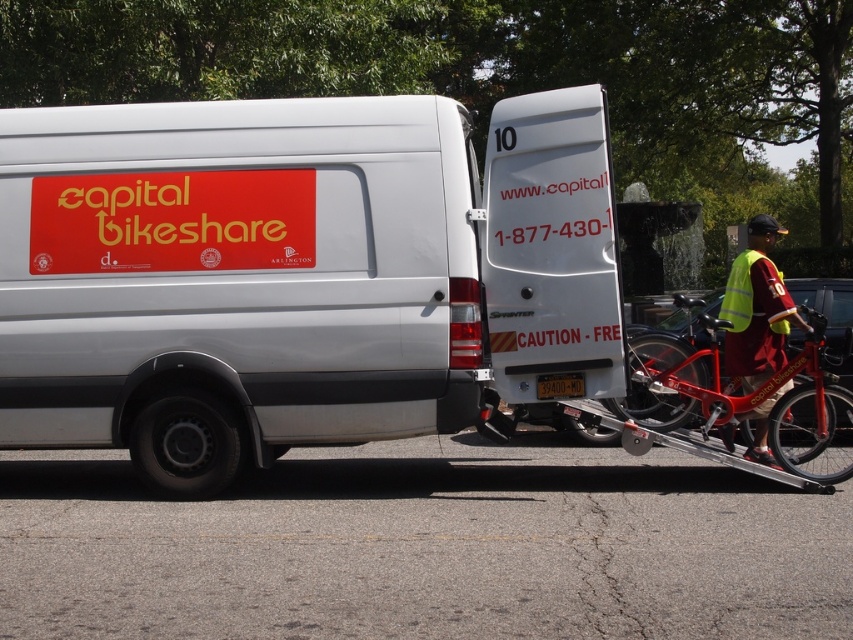
Does white matte van at center appear on the right side of reflective yellow vest at right?

No, white matte van at center is not to the right of reflective yellow vest at right.

Can you confirm if white matte van at center is thinner than reflective yellow vest at right?

Yes.

Which is in front, point (376, 250) or point (756, 314)?

Positioned in front is point (376, 250).

Find the location of a particular element. Image resolution: width=853 pixels, height=640 pixels. white matte van at center is located at coordinates coord(299,275).

Who is positioned more to the left, metallic red bicycle at right or reflective yellow vest at right?

metallic red bicycle at right

Which is behind, point (846, 458) or point (741, 269)?

The point (846, 458) is more distant.

This screenshot has width=853, height=640. In order to click on metallic red bicycle at right in this screenshot , I will do `click(732, 404)`.

Is point (227, 480) in front of point (700, 320)?

Yes, point (227, 480) is closer to viewer.

Looking at this image, does white matte van at center have a greater height compared to metallic red bicycle at right?

Yes, white matte van at center is taller than metallic red bicycle at right.

Describe the element at coordinates (299, 275) in the screenshot. I see `white matte van at center` at that location.

At what (x,y) coordinates should I click in order to perform the action: click on white matte van at center. Please return your answer as a coordinate pair (x, y). The height and width of the screenshot is (640, 853). Looking at the image, I should click on (299, 275).